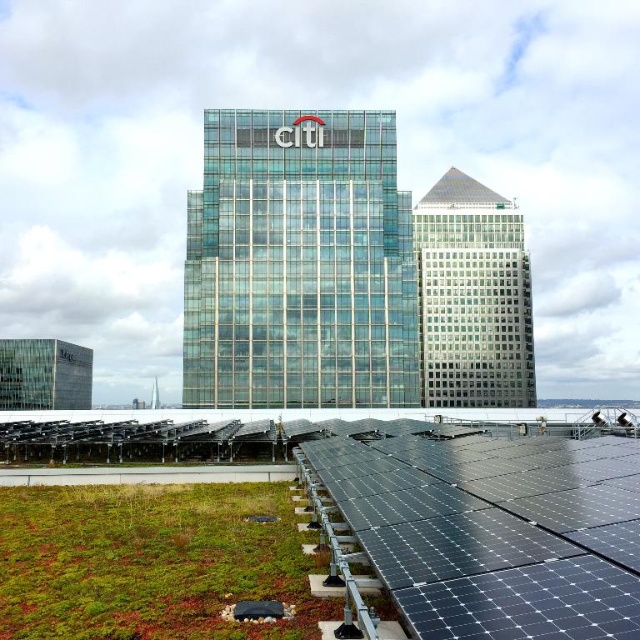
Does point (182, 616) lie in front of point (486, 195)?

Yes, it is in front of point (486, 195).

Between point (173, 604) and point (426, 193), which one is positioned in front?

Positioned in front is point (173, 604).

Find the location of a particular element. This screenshot has width=640, height=640. green mossy roof at lower left is located at coordinates (152, 563).